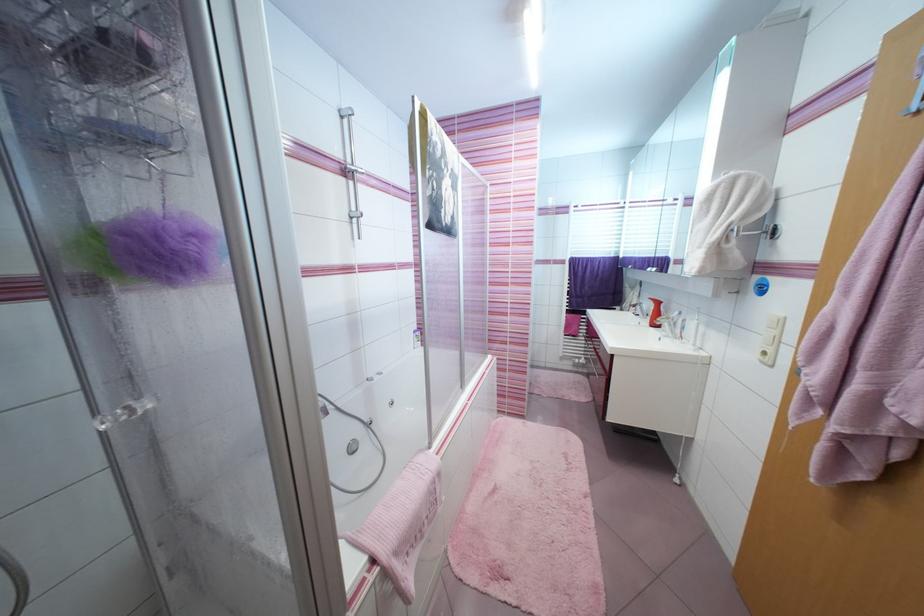
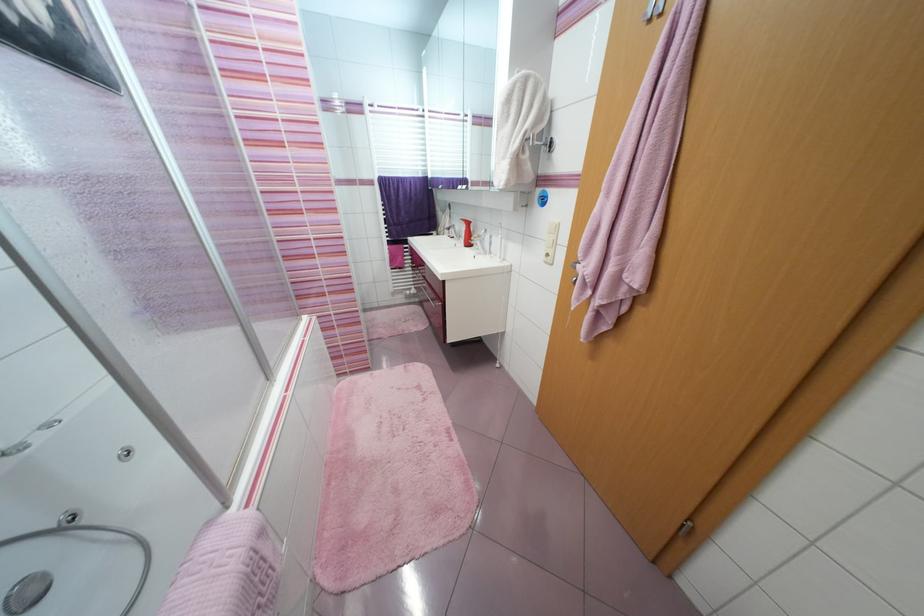
Find the pixel in the second image that matches point 779,233 in the first image.

(555, 147)